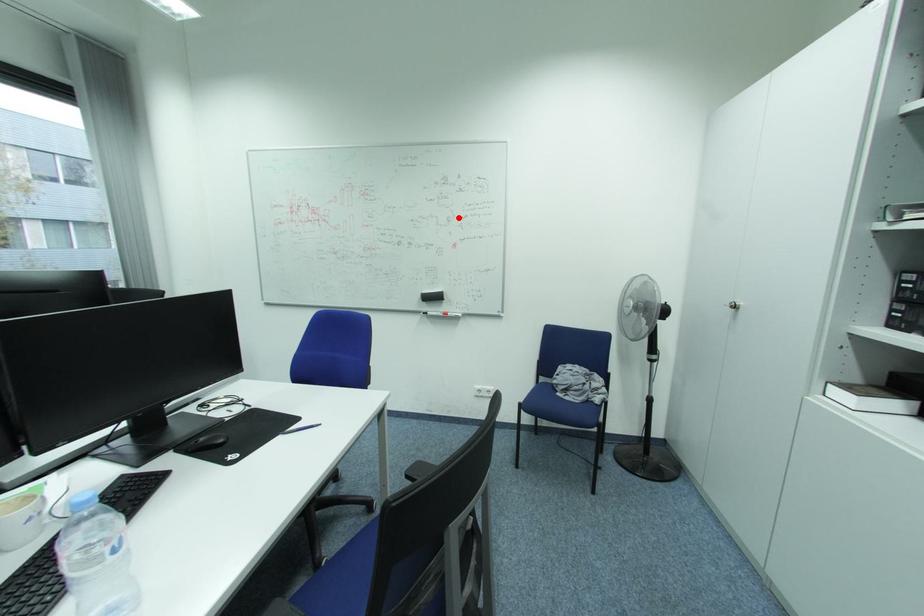
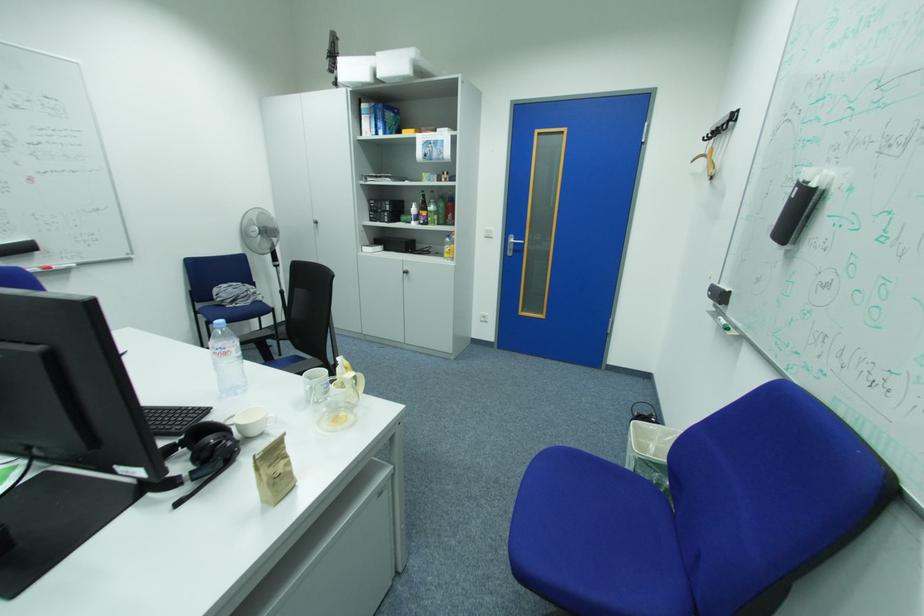
Question: I am providing you with two images of the same scene from different viewpoints. A red point is shown in image1. For the corresponding object point in image2, is it positioned nearer or farther from the camera?

Choices:
 (A) Nearer
 (B) Farther

Answer: (B)